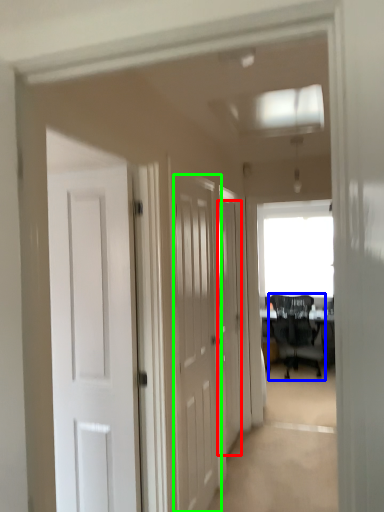
Question: Estimate the real-world distances between objects in this image. Which object is closer to door (highlighted by a red box), chair (highlighted by a blue box) or door (highlighted by a green box)?

Choices:
 (A) chair
 (B) door

Answer: (B)